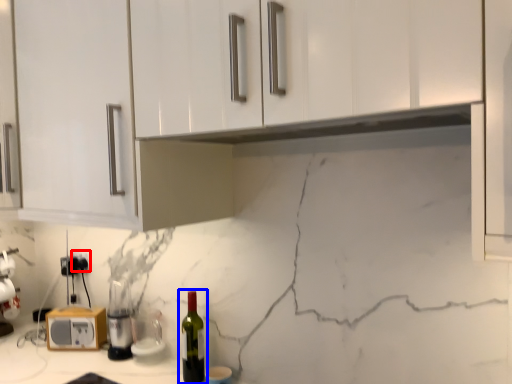
Question: Which object appears farthest to the camera in this image, electric outlet (highlighted by a red box) or bottle (highlighted by a blue box)?

Choices:
 (A) electric outlet
 (B) bottle

Answer: (A)